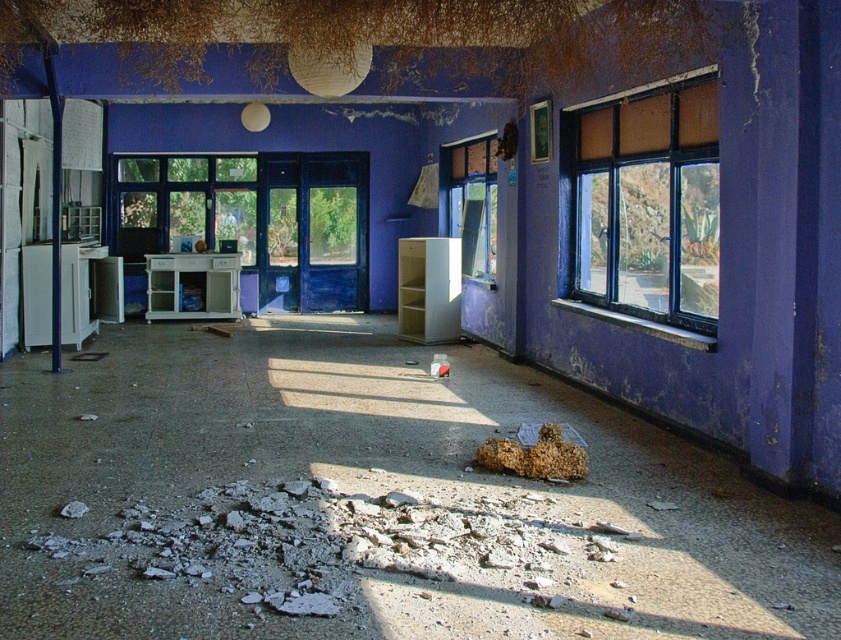
You are a maintenance worker assessing the damage in the room. You notice the transparent glass window at center and the crumbly brown bread at lower center. Which object is located more to the left side of the room?

The transparent glass window at center is positioned on the left side of crumbly brown bread at lower center, so it is more to the left.

You are a maintenance worker inspecting the abandoned interior space. You notice the transparent glass window at center and the crumbly brown bread at lower center. Which object is positioned higher in the room?

The transparent glass window at center is located above the crumbly brown bread at lower center, so it is positioned higher in the room.

You are a contractor assessing the damage in this room. You need to determine which of the two windows, the matte glass window at right or the transparent glass window at center, requires more materials for repair based on their size. Which window should you prioritize?

The matte glass window at right is larger in size than the transparent glass window at center, so you should prioritize repairing the matte glass window at right first as it requires more materials.